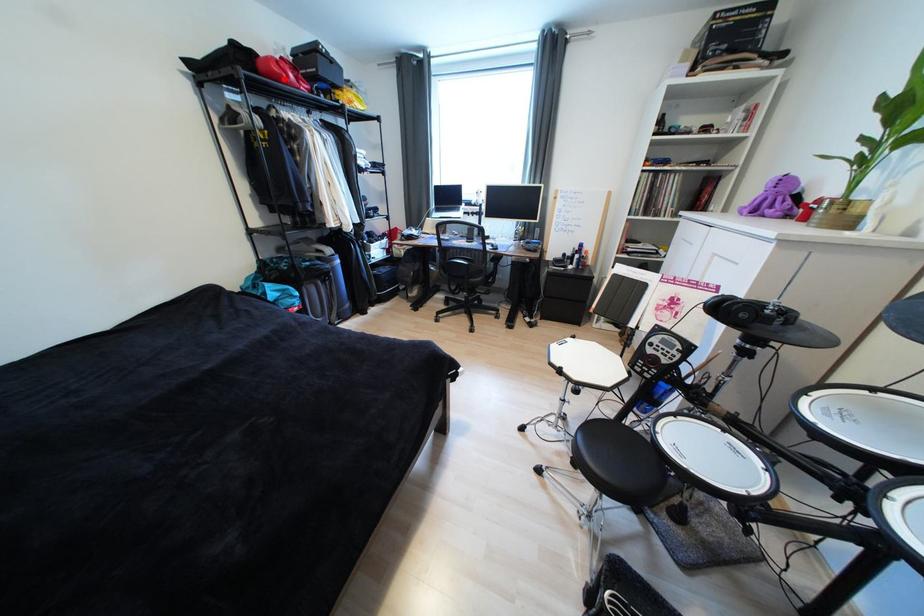
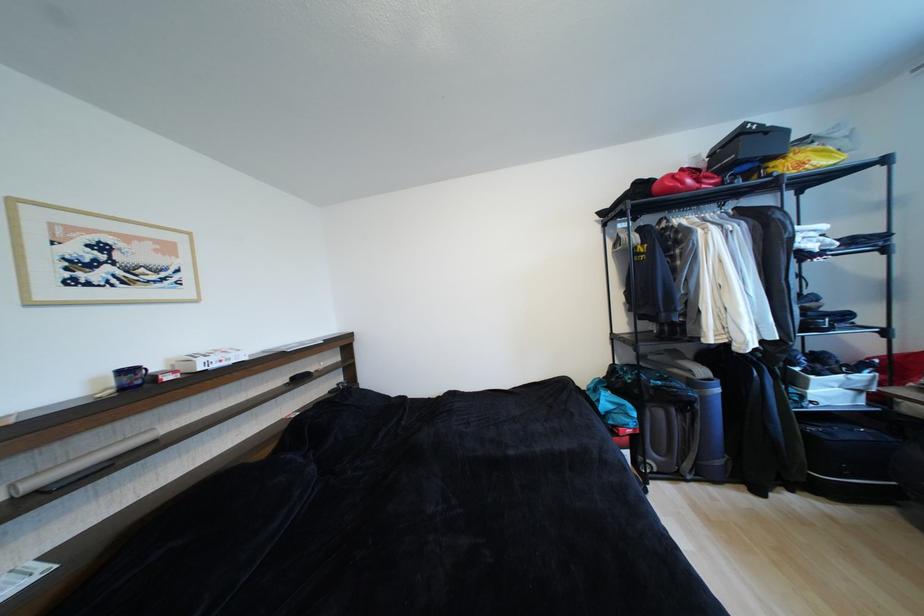
Question: I am providing you with two images of the same scene from different viewpoints. A red point is marked on the first image. Can you still see the location of the red point in image 2?

Choices:
 (A) Yes
 (B) No

Answer: (A)